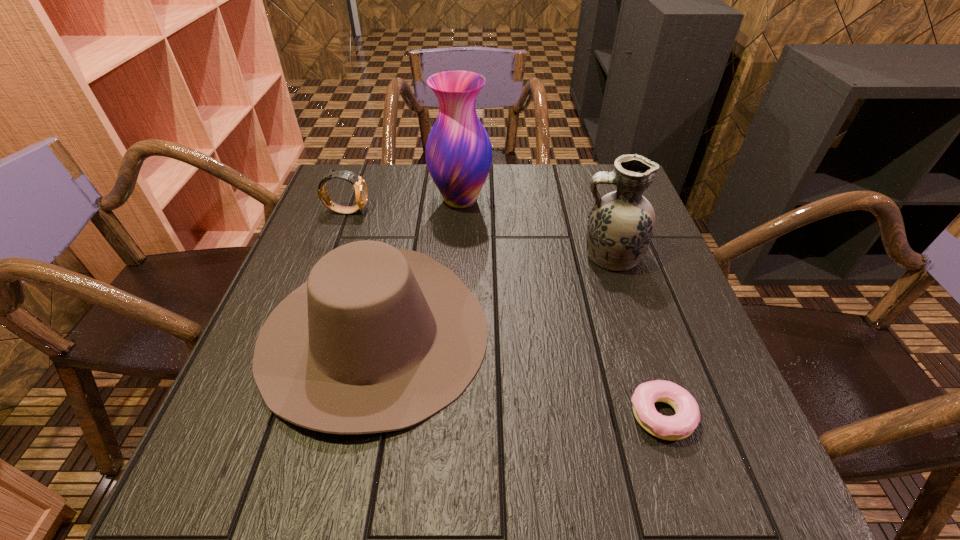
Find the location of a particular element. vacant space that's between the shortest object and the watch is located at coordinates (504, 313).

The width and height of the screenshot is (960, 540). I want to click on free space between the shortest object and the cowboy hat, so click(x=517, y=374).

This screenshot has height=540, width=960. Identify the location of vacant area between the cowboy hat and the right vase. (492, 295).

Identify the location of free space that is in between the second shortest object and the shortest object. The width and height of the screenshot is (960, 540). (504, 313).

The height and width of the screenshot is (540, 960). In order to click on free space between the cowboy hat and the doughnut in this screenshot , I will do `click(517, 374)`.

The height and width of the screenshot is (540, 960). I want to click on empty space that is in between the watch and the doughnut, so click(x=504, y=313).

Locate an element on the screen. The width and height of the screenshot is (960, 540). vacant space that is in between the watch and the shortest object is located at coordinates (504, 313).

Identify which object is the closest to the third shortest object. Please provide its 2D coordinates. Your answer should be formatted as a tuple, i.e. [(x, y)], where the tuple contains the x and y coordinates of a point satisfying the conditions above.

[(361, 193)]

Find the location of a particular element. the closest object to the cowboy hat is located at coordinates (361, 193).

Find the location of a particular element. The height and width of the screenshot is (540, 960). free spot that satisfies the following two spatial constraints: 1. on the face of the fourth tallest object; 2. on the left side of the cowboy hat is located at coordinates (301, 333).